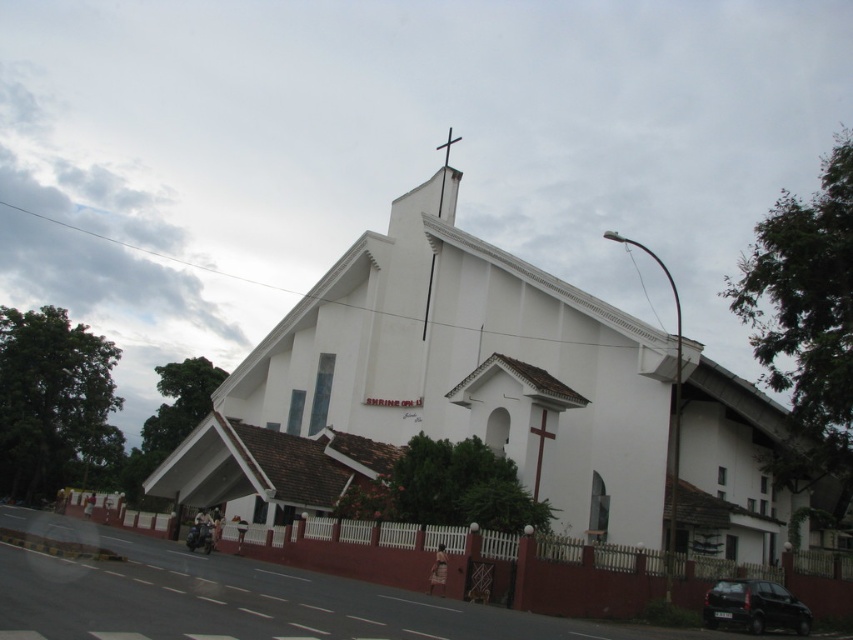
Question: Can you confirm if black matte car at lower right is wider than white smooth cross at upper center?

Choices:
 (A) yes
 (B) no

Answer: (B)

Question: Is white smooth church at center behind white wooden cross at upper center?

Choices:
 (A) no
 (B) yes

Answer: (A)

Question: Which point appears farthest from the camera in this image?

Choices:
 (A) (447, 134)
 (B) (447, 157)
 (C) (730, 586)
 (D) (292, 444)

Answer: (A)

Question: Which object is farther from the camera taking this photo?

Choices:
 (A) white smooth church at center
 (B) white smooth cross at upper center
 (C) black matte car at lower right

Answer: (B)

Question: Among these objects, which one is nearest to the camera?

Choices:
 (A) white smooth church at center
 (B) white wooden cross at upper center

Answer: (A)

Question: Is white smooth cross at upper center thinner than white wooden cross at upper center?

Choices:
 (A) no
 (B) yes

Answer: (B)